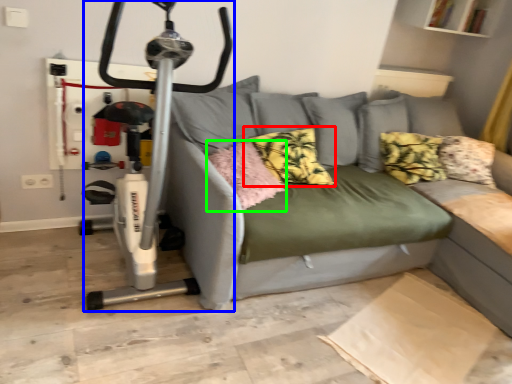
Question: Which is nearer to the pillow (highlighted by a red box)? sport equipment (highlighted by a blue box) or pillow (highlighted by a green box).

Choices:
 (A) sport equipment
 (B) pillow

Answer: (B)